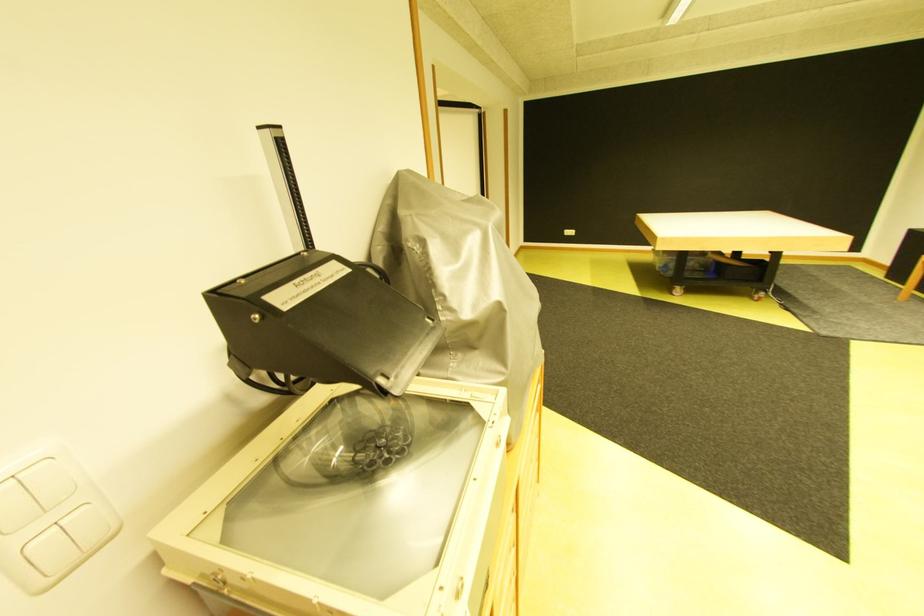
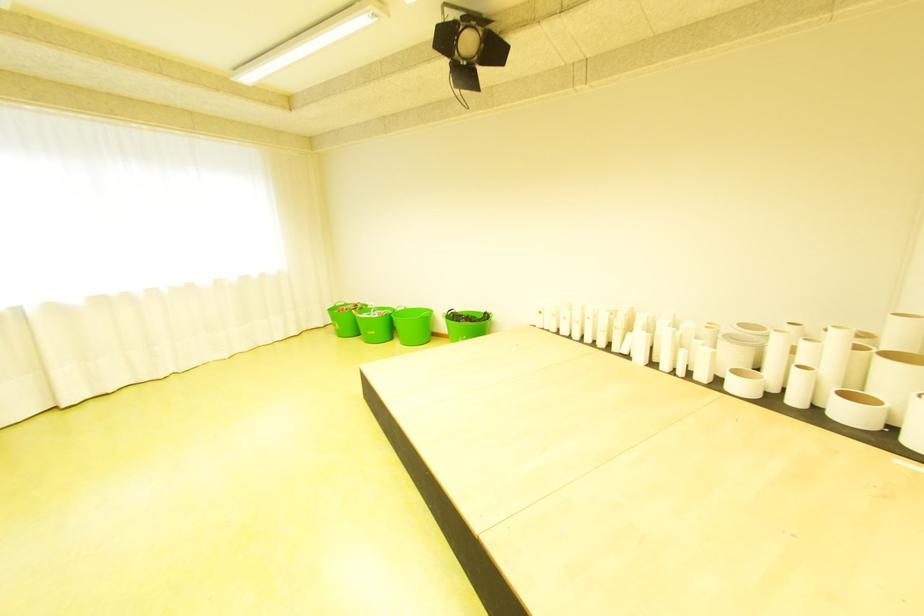
What movement of the cameraman would produce the second image?

The cameraman moved toward left, forward.